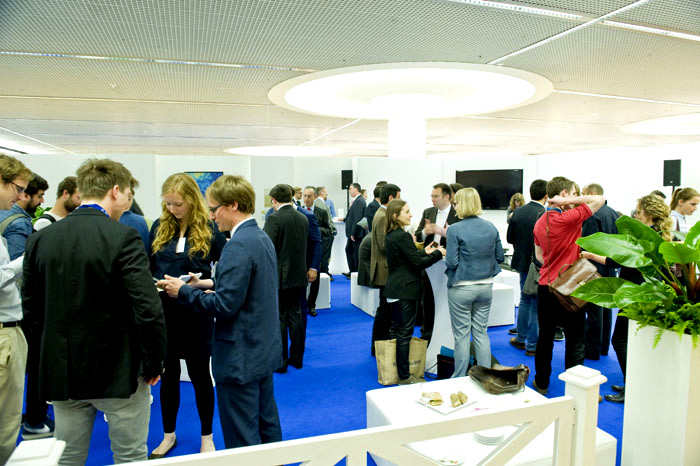
Where is `blue carpet`? This screenshot has height=466, width=700. blue carpet is located at coordinates (334, 367).